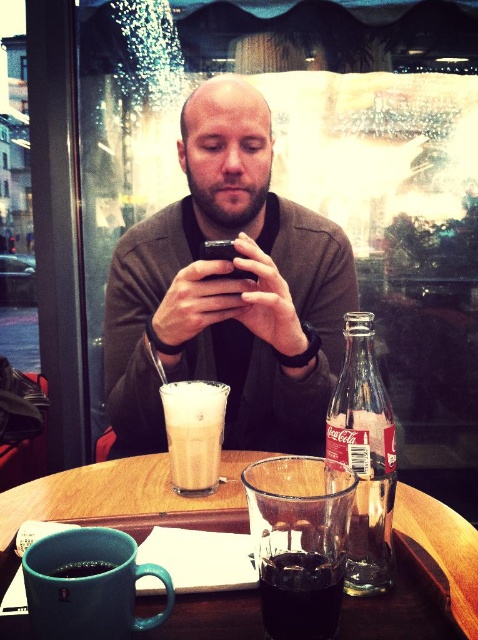
You are a barista carrying a tray of drinks and need to place them on the wooden tray at center. There is already a matte ceramic mug at lower left on the table. Can you fit your tray next to the existing mug without spilling anything?

The wooden tray at center and matte ceramic mug at lower left are 10.38 inches apart from each other, so there is enough space to place the tray next to the existing mug without causing any spills.

You are a customer sitting at the wooden table in the cozy cafe. You want to reach for the Coca Cola bottle located at point (65,573) and the coffee cup at point (351,467). Which item is closer to you?

Point (65,573) is closer to you than point (351,467), so the Coca Cola bottle at point (65,573) is closer to you.